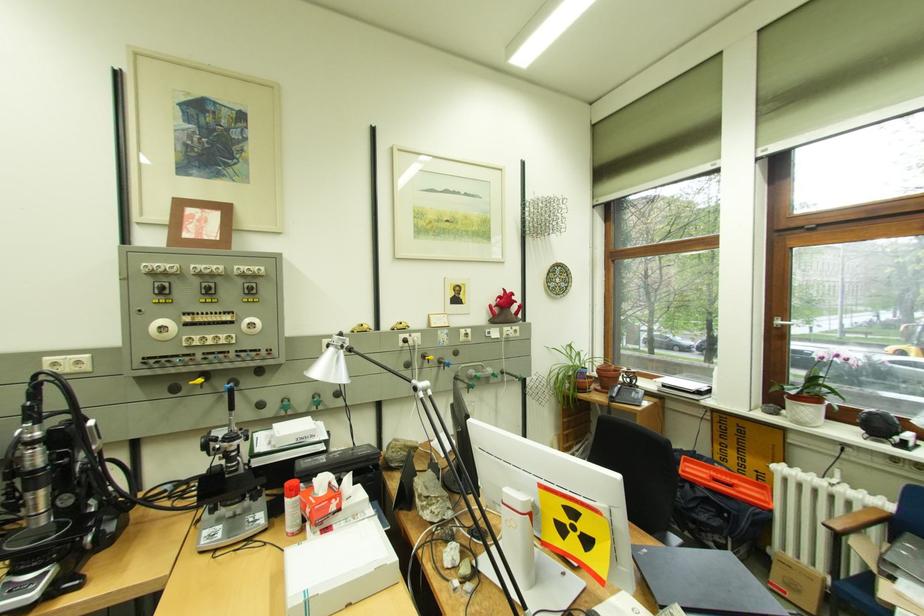
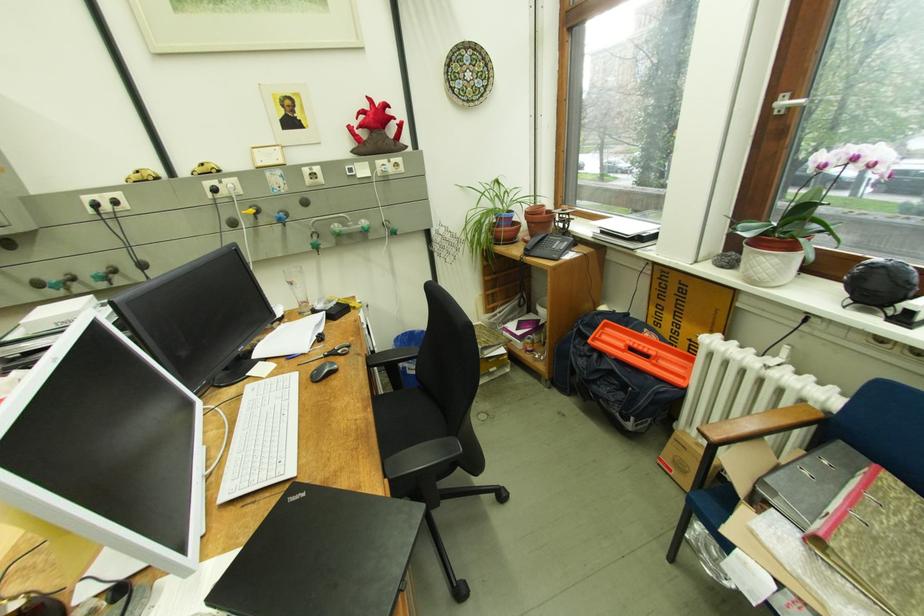
In the second image, find the point that corresponds to (798,403) in the first image.

(758, 249)